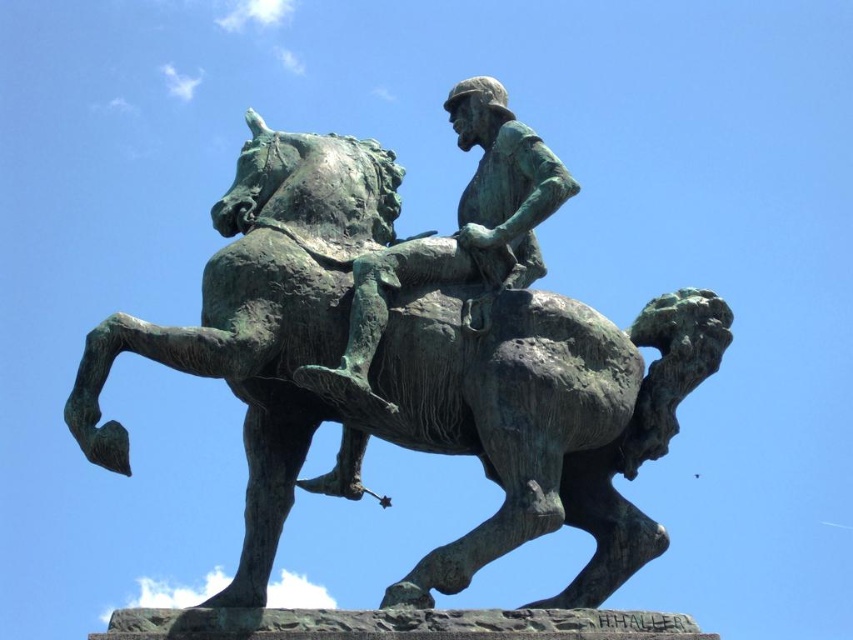
Question: Which point is farther to the camera?

Choices:
 (A) click(x=332, y=380)
 (B) click(x=363, y=186)

Answer: (B)

Question: From the image, what is the correct spatial relationship of green patina horse and rider at center in relation to green patina figure at center?

Choices:
 (A) left
 (B) right

Answer: (A)

Question: Can you confirm if green patina horse and rider at center is thinner than green patina figure at center?

Choices:
 (A) no
 (B) yes

Answer: (A)

Question: Can you confirm if green patina horse and rider at center is positioned to the right of green patina figure at center?

Choices:
 (A) no
 (B) yes

Answer: (A)